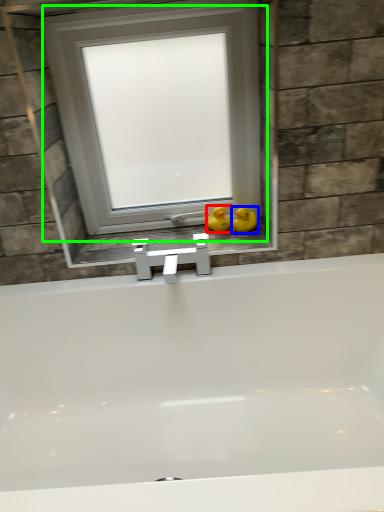
Question: Which object is positioned closest to duck (highlighted by a red box)? Select from duck (highlighted by a blue box) and window (highlighted by a green box).

Choices:
 (A) duck
 (B) window

Answer: (A)